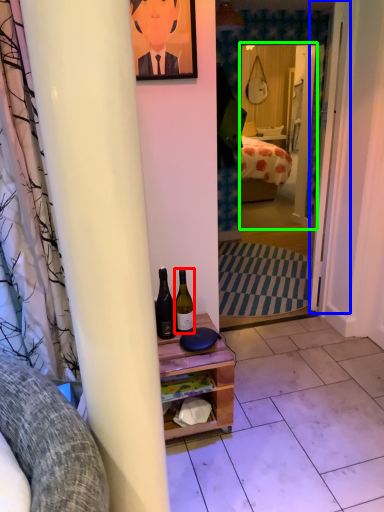
Question: Which is nearer to the bottle (highlighted by a red box)? door (highlighted by a blue box) or mirror (highlighted by a green box).

Choices:
 (A) door
 (B) mirror

Answer: (A)